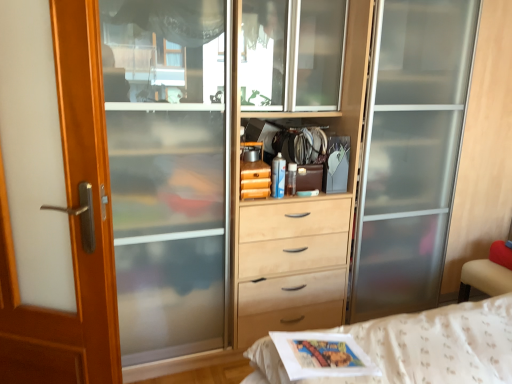
Question: Is wooden door at left oriented towards matte gray magazine at center?

Choices:
 (A) no
 (B) yes

Answer: (A)

Question: From a real-world perspective, does wooden door at left stand above matte gray magazine at center?

Choices:
 (A) no
 (B) yes

Answer: (A)

Question: Is wooden door at left smaller than matte gray magazine at center?

Choices:
 (A) no
 (B) yes

Answer: (A)

Question: From the image's perspective, is wooden door at left beneath matte gray magazine at center?

Choices:
 (A) yes
 (B) no

Answer: (A)

Question: From the image's perspective, would you say wooden door at left is positioned over matte gray magazine at center?

Choices:
 (A) no
 (B) yes

Answer: (A)

Question: Can you confirm if wooden door at left is bigger than matte gray magazine at center?

Choices:
 (A) yes
 (B) no

Answer: (A)

Question: Is matte gray magazine at center positioned behind wooden door at left?

Choices:
 (A) yes
 (B) no

Answer: (A)

Question: Considering the relative sizes of matte gray magazine at center and wooden door at left in the image provided, is matte gray magazine at center taller than wooden door at left?

Choices:
 (A) yes
 (B) no

Answer: (B)

Question: Does matte gray magazine at center have a larger size compared to wooden door at left?

Choices:
 (A) no
 (B) yes

Answer: (A)

Question: From a real-world perspective, is matte gray magazine at center under wooden door at left?

Choices:
 (A) yes
 (B) no

Answer: (B)

Question: Is matte gray magazine at center completely or partially outside of wooden door at left?

Choices:
 (A) yes
 (B) no

Answer: (A)

Question: Considering the relative sizes of matte gray magazine at center and wooden door at left in the image provided, is matte gray magazine at center wider than wooden door at left?

Choices:
 (A) no
 (B) yes

Answer: (B)

Question: Looking at the image, does wooden door at left seem bigger or smaller compared to matte gray magazine at center?

Choices:
 (A) big
 (B) small

Answer: (A)